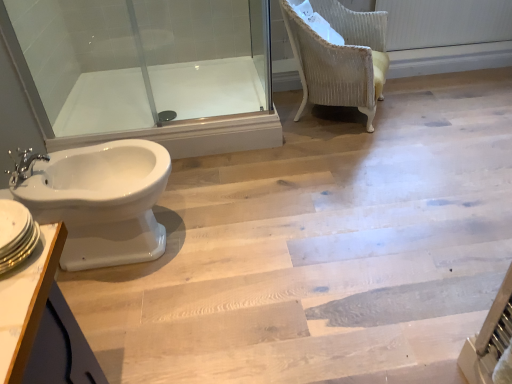
You are a GUI agent. You are given a task and a screenshot of the screen. Output one action in this format:
    pyautogui.click(x=<x>, y=<y>)
    Task: Click on the free space that is in between velvet yellow chair at upper right and white glossy bidet at lower left
    The height and width of the screenshot is (384, 512).
    Given the screenshot: What is the action you would take?
    pyautogui.click(x=260, y=177)